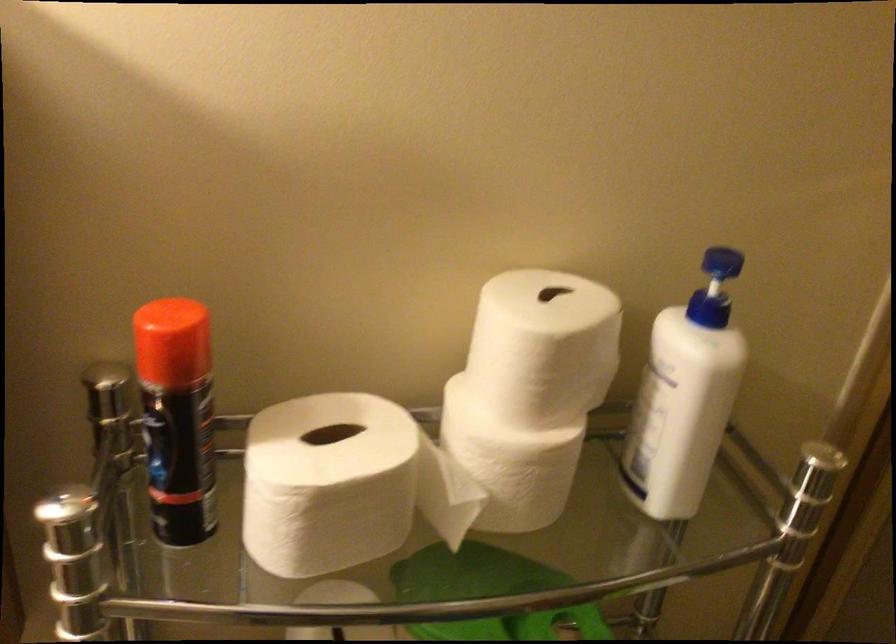
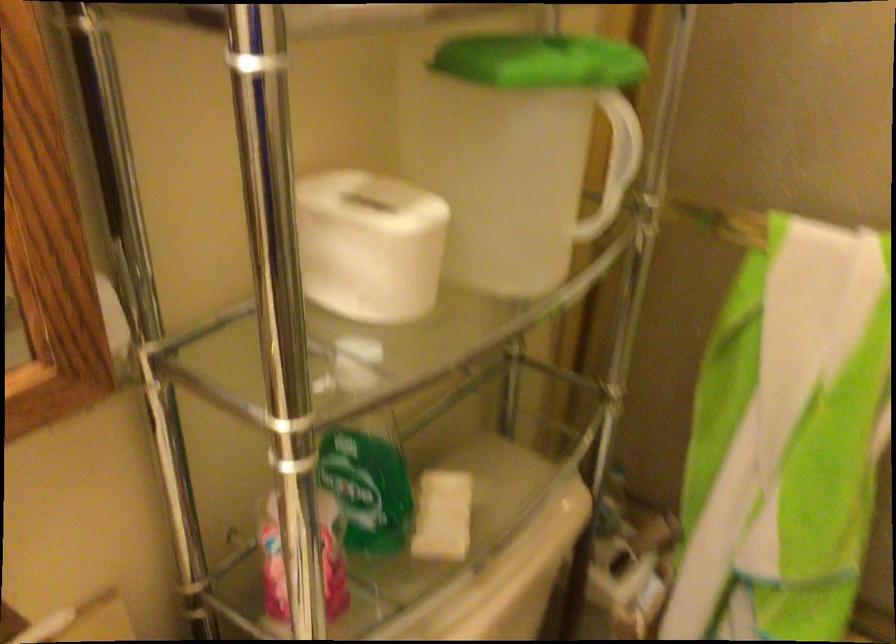
Question: The first image is from the beginning of the video and the second image is from the end. How did the camera likely rotate when shooting the video?

Choices:
 (A) Left
 (B) Right
 (C) Up
 (D) Down

Answer: (B)